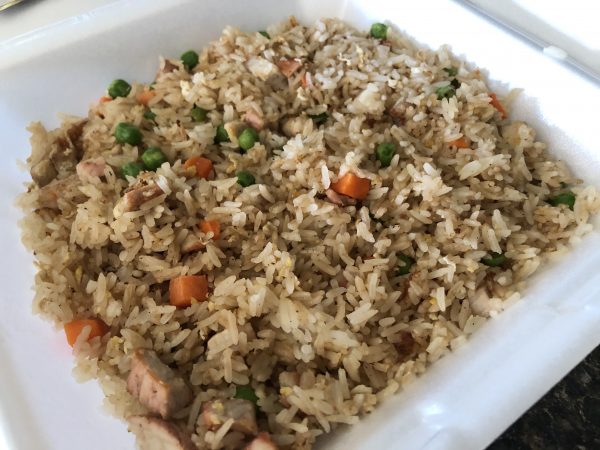
I want to click on bowl, so click(x=582, y=111), click(x=153, y=4), click(x=25, y=323), click(x=479, y=398).